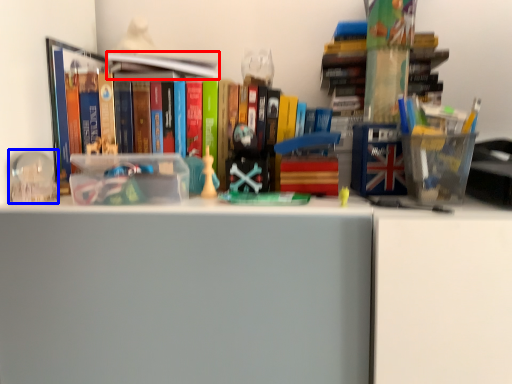
Question: Which point is closer to the camera, book (highlighted by a red box) or toy (highlighted by a blue box)?

Choices:
 (A) book
 (B) toy

Answer: (B)